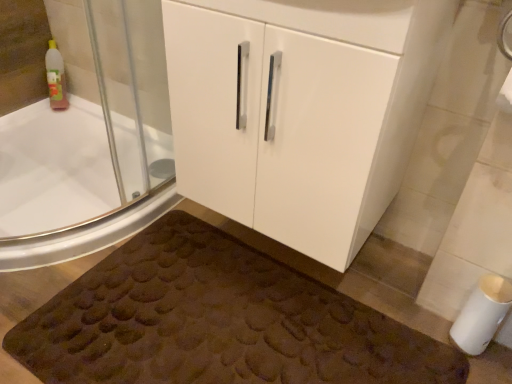
Identify the location of unoccupied space behind white glossy bathtub at upper left. (111, 171).